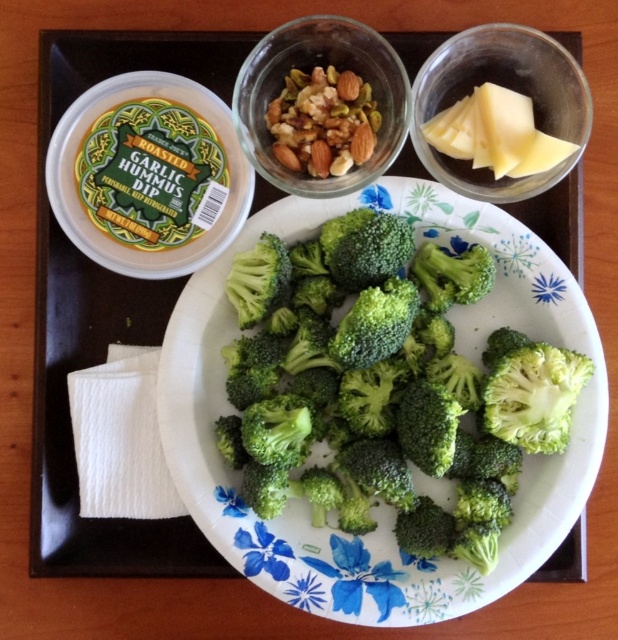
Question: Which point is closer to the camera?

Choices:
 (A) (302, 387)
 (B) (565, 104)
 (C) (57, 136)

Answer: (B)

Question: Is green fresh broccoli at center below white plastic container at upper left?

Choices:
 (A) no
 (B) yes

Answer: (B)

Question: Based on their relative distances, which object is nearer to the shiny brown nuts at center?

Choices:
 (A) yellowish hard cheese at upper right
 (B) yellow cheese at upper right
 (C) shiny glass bowl at upper center

Answer: (C)

Question: Which object is the closest to the yellowish hard cheese at upper right?

Choices:
 (A) shiny glass bowl at upper center
 (B) yellow cheese at upper right
 (C) green fresh broccoli at center

Answer: (B)

Question: Is green fresh broccoli at center to the left of yellowish hard cheese at upper right from the viewer's perspective?

Choices:
 (A) no
 (B) yes

Answer: (B)

Question: Is green fresh broccoli at center smaller than yellow cheese at upper right?

Choices:
 (A) no
 (B) yes

Answer: (A)